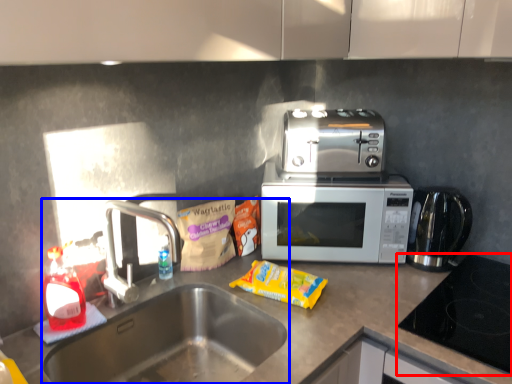
Question: Which of the following is the closest to the observer, gas stove (highlighted by a red box) or sink (highlighted by a blue box)?

Choices:
 (A) gas stove
 (B) sink

Answer: (B)